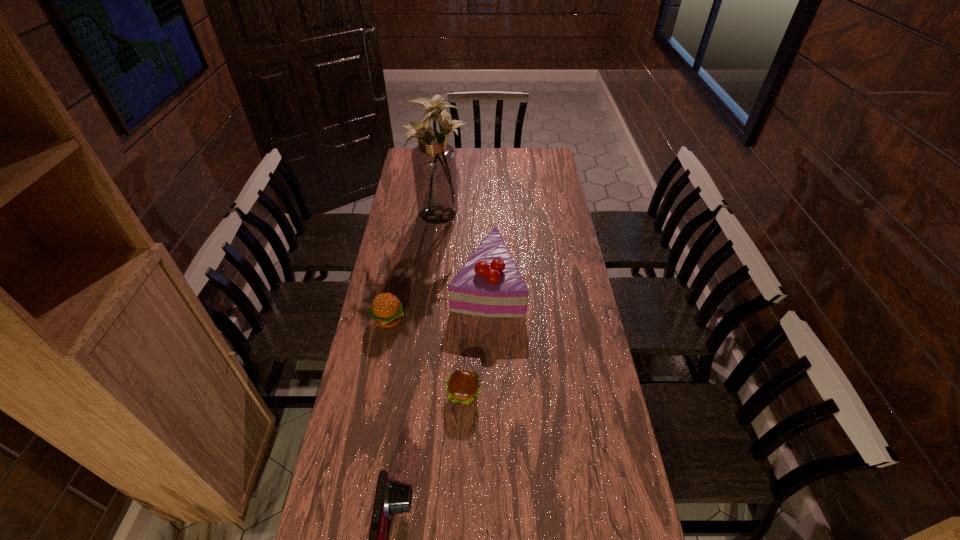
Identify the location of free point located on the back of the shortest object. (466, 324).

The image size is (960, 540). I want to click on flower arrangement located at the left edge, so (434, 160).

Find the location of a particular element. This screenshot has height=540, width=960. hamburger that is at the left edge is located at coordinates (387, 310).

This screenshot has width=960, height=540. In order to click on vacant point at the far edge in this screenshot , I will do `click(486, 170)`.

Locate an element on the screen. vacant space at the left edge of the desktop is located at coordinates (334, 497).

Find the location of a particular element. This screenshot has width=960, height=540. vacant space at the right edge of the desktop is located at coordinates (564, 235).

In the image, there is a desktop. At what (x,y) coordinates should I click in order to perform the action: click on free space at the far left corner. Please return your answer as a coordinate pair (x, y). Looking at the image, I should click on (411, 150).

This screenshot has height=540, width=960. In order to click on vacant space at the far right corner in this screenshot , I will do `click(549, 166)`.

At what (x,y) coordinates should I click in order to perform the action: click on unoccupied position between the second tallest object and the fourth farthest object. Please return your answer as a coordinate pair (x, y). The image size is (960, 540). Looking at the image, I should click on (475, 339).

Identify the location of free space between the farther hamburger and the flower arrangement. The width and height of the screenshot is (960, 540). (415, 266).